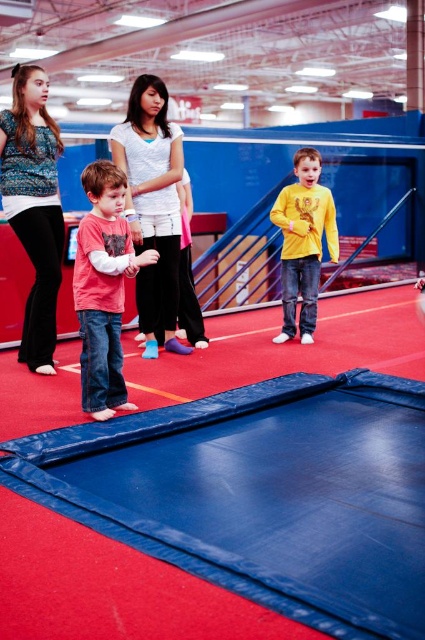
Based on the photo, is pink cotton shirt at left positioned behind yellow matte shirt at center?

No.

Between pink cotton shirt at left and yellow matte shirt at center, which one appears on the right side from the viewer's perspective?

From the viewer's perspective, yellow matte shirt at center appears more on the right side.

Is point (99, 349) positioned in front of point (288, 314)?

Yes, it is.

Identify the location of pink cotton shirt at left. (104, 289).

Does blue rubber mat at center appear under patterned fabric blouse at upper left?

Correct, blue rubber mat at center is located below patterned fabric blouse at upper left.

Which is in front, point (419, 609) or point (39, 122)?

Point (419, 609) is more forward.

What do you see at coordinates (261, 493) in the screenshot? This screenshot has height=640, width=425. I see `blue rubber mat at center` at bounding box center [261, 493].

Find the location of a particular element. The width and height of the screenshot is (425, 640). blue rubber mat at center is located at coordinates (261, 493).

Between white cotton shirt at center and yellow matte shirt at center, which one has more height?

Standing taller between the two is white cotton shirt at center.

Is white cotton shirt at center to the right of yellow matte shirt at center from the viewer's perspective?

No, white cotton shirt at center is not to the right of yellow matte shirt at center.

Who is more forward, (175, 125) or (302, 282)?

Point (175, 125)

Where is `white cotton shirt at center`? The image size is (425, 640). white cotton shirt at center is located at coordinates (153, 205).